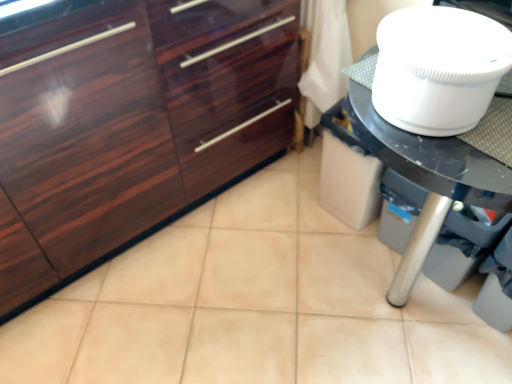
The image size is (512, 384). What do you see at coordinates (429, 180) in the screenshot?
I see `white glossy table at right` at bounding box center [429, 180].

What do you see at coordinates (438, 68) in the screenshot? I see `white plastic toilet bowl at upper right` at bounding box center [438, 68].

I want to click on glossy wood cabinetry at left, so click(x=136, y=125).

Is glossy wood cabinetry at left to the left of white glossy table at right from the viewer's perspective?

Yes, glossy wood cabinetry at left is to the left of white glossy table at right.

From a real-world perspective, is glossy wood cabinetry at left located higher than white glossy table at right?

Yes, from a real-world perspective, glossy wood cabinetry at left is on top of white glossy table at right.

Is glossy wood cabinetry at left completely or partially outside of white glossy table at right?

That's correct, glossy wood cabinetry at left is outside of white glossy table at right.

Is glossy wood cabinetry at left directly adjacent to white glossy table at right?

glossy wood cabinetry at left and white glossy table at right are clearly separated.

From the image's perspective, is glossy wood cabinetry at left over white plastic toilet bowl at upper right?

Yes, from the image's perspective, glossy wood cabinetry at left is over white plastic toilet bowl at upper right.

Locate an element on the screen. cabinetry above the white plastic toilet bowl at upper right (from the image's perspective) is located at coordinates (136, 125).

Considering the relative sizes of glossy wood cabinetry at left and white plastic toilet bowl at upper right in the image provided, is glossy wood cabinetry at left smaller than white plastic toilet bowl at upper right?

No, glossy wood cabinetry at left is not smaller than white plastic toilet bowl at upper right.

How different are the orientations of glossy wood cabinetry at left and white plastic toilet bowl at upper right in degrees?

89 degrees.

How different are the orientations of white glossy table at right and glossy wood cabinetry at left in degrees?

91.4 degrees.

Can glossy wood cabinetry at left be found inside white glossy table at right?

No, glossy wood cabinetry at left is not inside white glossy table at right.

Can you see white glossy table at right touching glossy wood cabinetry at left?

No, white glossy table at right is not in contact with glossy wood cabinetry at left.

From the image's perspective, is white glossy table at right under glossy wood cabinetry at left?

Yes.

From a real-world perspective, is white plastic toilet bowl at upper right positioned above or below white glossy table at right?

white plastic toilet bowl at upper right is situated higher than white glossy table at right in the real world.

Is white plastic toilet bowl at upper right spatially inside white glossy table at right, or outside of it?

white plastic toilet bowl at upper right is located beyond the bounds of white glossy table at right.

Locate an element on the screen. countertop behind the white plastic toilet bowl at upper right is located at coordinates (429, 180).

How different are the orientations of white plastic toilet bowl at upper right and white glossy table at right in degrees?

They differ by 2.38 degrees in their facing directions.

Are white plastic toilet bowl at upper right and glossy wood cabinetry at left beside each other?

white plastic toilet bowl at upper right and glossy wood cabinetry at left are clearly separated.

There is a glossy wood cabinetry at left. Identify the location of toilet bowl above it (from a real-world perspective). The image size is (512, 384). (438, 68).

Measure the distance between white plastic toilet bowl at upper right and glossy wood cabinetry at left.

white plastic toilet bowl at upper right is 26.90 inches away from glossy wood cabinetry at left.

From a real-world perspective, who is located lower, white plastic toilet bowl at upper right or glossy wood cabinetry at left?

glossy wood cabinetry at left.

Would you say white glossy table at right is a long distance from white plastic toilet bowl at upper right?

They are positioned close to each other.

How far apart are white glossy table at right and white plastic toilet bowl at upper right?

white glossy table at right and white plastic toilet bowl at upper right are 38.51 centimeters apart.

Visually, is white glossy table at right positioned to the left or to the right of white plastic toilet bowl at upper right?

Based on their positions, white glossy table at right is located to the right of white plastic toilet bowl at upper right.

Is white plastic toilet bowl at upper right completely or partially inside white glossy table at right?

Definitely not — white plastic toilet bowl at upper right is not inside white glossy table at right.

Where is `countertop below the glossy wood cabinetry at left (from the image's perspective)`? The width and height of the screenshot is (512, 384). countertop below the glossy wood cabinetry at left (from the image's perspective) is located at coordinates (429, 180).

Where is `toilet bowl in front of the glossy wood cabinetry at left`? The width and height of the screenshot is (512, 384). toilet bowl in front of the glossy wood cabinetry at left is located at coordinates (438, 68).

Looking at the image, which one is located closer to glossy wood cabinetry at left, white plastic toilet bowl at upper right or white glossy table at right?

white plastic toilet bowl at upper right is positioned closer to the anchor glossy wood cabinetry at left.

Which object lies further to the anchor point glossy wood cabinetry at left, white glossy table at right or white plastic toilet bowl at upper right?

white glossy table at right.

Looking at the image, which one is located closer to white glossy table at right, glossy wood cabinetry at left or white plastic toilet bowl at upper right?

white plastic toilet bowl at upper right is positioned closer to the anchor white glossy table at right.

Based on their spatial positions, is white plastic toilet bowl at upper right or glossy wood cabinetry at left closer to white glossy table at right?

Based on the image, white plastic toilet bowl at upper right appears to be nearer to white glossy table at right.

When comparing their distances from white plastic toilet bowl at upper right, does glossy wood cabinetry at left or white glossy table at right seem closer?

white glossy table at right lies closer to white plastic toilet bowl at upper right than the other object.

Estimate the real-world distances between objects in this image. Which object is closer to white plastic toilet bowl at upper right, white glossy table at right or glossy wood cabinetry at left?

The object closer to white plastic toilet bowl at upper right is white glossy table at right.

I want to click on toilet bowl between glossy wood cabinetry at left and white glossy table at right in the horizontal direction, so click(x=438, y=68).